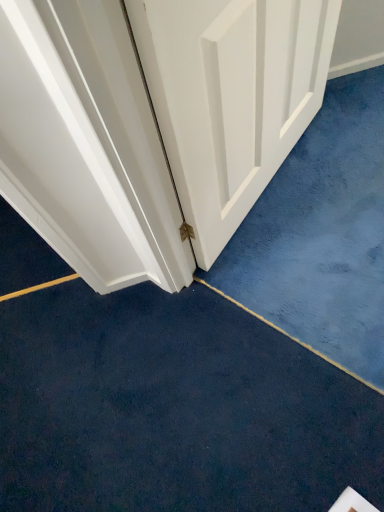
You are a GUI agent. You are given a task and a screenshot of the screen. Output one action in this format:
    pyautogui.click(x=<x>, y=<y>)
    Task: Click on the white matte door at center
    This screenshot has height=512, width=384.
    Given the screenshot: What is the action you would take?
    pyautogui.click(x=231, y=96)

The height and width of the screenshot is (512, 384). What do you see at coordinates (231, 96) in the screenshot?
I see `white matte door at center` at bounding box center [231, 96].

Where is `white matte door at center`? white matte door at center is located at coordinates pyautogui.click(x=231, y=96).